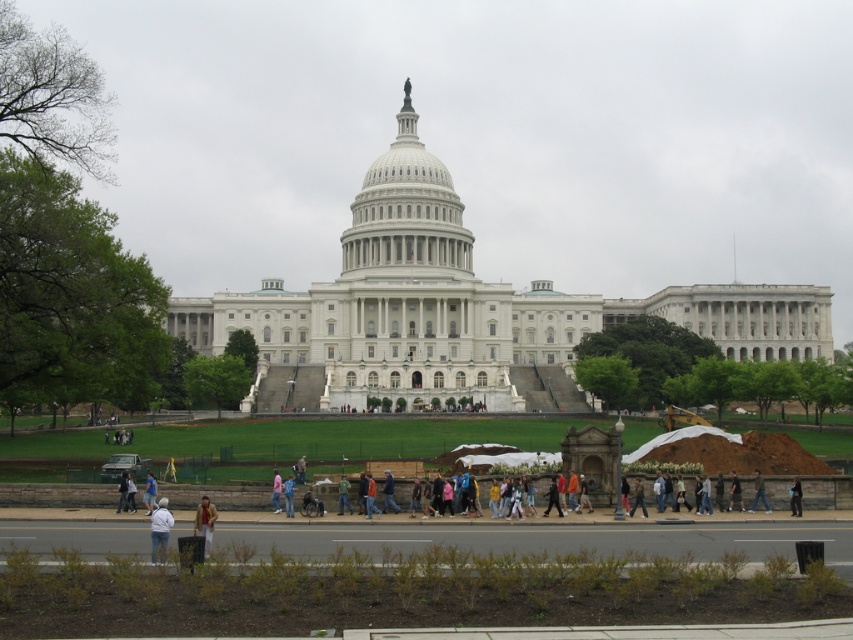
This screenshot has width=853, height=640. Find the location of `light blue shirt at lower center`. light blue shirt at lower center is located at coordinates (149, 493).

Image resolution: width=853 pixels, height=640 pixels. Find the location of `light blue shirt at lower center`. light blue shirt at lower center is located at coordinates (149, 493).

Is white cotton shirt at lower center to the left of green denim jacket at center from the viewer's perspective?

Yes, white cotton shirt at lower center is to the left of green denim jacket at center.

Describe the element at coordinates (160, 531) in the screenshot. I see `white cotton shirt at lower center` at that location.

Locate an element on the screen. white cotton shirt at lower center is located at coordinates (160, 531).

Looking at this image, between pink fabric at center and light brown leather jacket at lower left, which one is positioned higher?

pink fabric at center is above.

This screenshot has height=640, width=853. In order to click on pink fabric at center in this screenshot , I will do `click(288, 496)`.

Does point (286, 513) lie behind point (123, 472)?

That is False.

Locate an element on the screen. This screenshot has height=640, width=853. pink fabric at center is located at coordinates (288, 496).